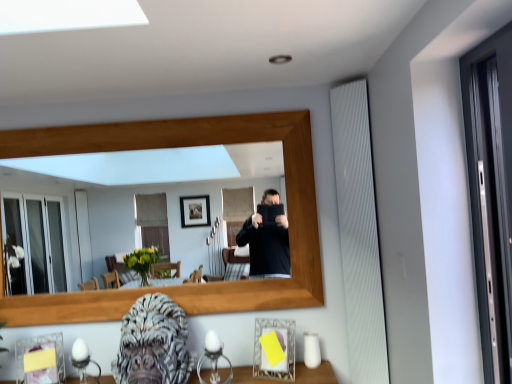
The width and height of the screenshot is (512, 384). Describe the element at coordinates (153, 190) in the screenshot. I see `wooden frame at center` at that location.

The image size is (512, 384). Describe the element at coordinates (153, 343) in the screenshot. I see `gray textured gorilla head at lower center` at that location.

This screenshot has height=384, width=512. What do you see at coordinates (281, 349) in the screenshot? I see `matte glass picture frame at lower right, which is counted as the 1th picture frame, starting from the right` at bounding box center [281, 349].

This screenshot has width=512, height=384. What are the coordinates of `matte glass picture frame at lower right, which is counted as the 1th picture frame, starting from the right` in the screenshot? It's located at (281, 349).

At what (x,y) coordinates should I click in order to perform the action: click on yellow paper at lower left, which is the 2th picture frame from right to left. Please return your answer as a coordinate pair (x, y). The image size is (512, 384). Looking at the image, I should click on click(40, 360).

Based on the photo, is yellow paper at lower left, which is counted as the first picture frame, starting from the left, wider or thinner than wooden frame at center?

Considering their sizes, yellow paper at lower left, which is counted as the first picture frame, starting from the left, looks broader than wooden frame at center.

Could you tell me if yellow paper at lower left, which is the 2th picture frame from right to left, is facing wooden frame at center?

No, yellow paper at lower left, which is the 2th picture frame from right to left, is not aimed at wooden frame at center.

Consider the image. Considering their positions, is yellow paper at lower left, which is the 2th picture frame from right to left, located in front of or behind wooden frame at center?

yellow paper at lower left, which is the 2th picture frame from right to left, is in front of wooden frame at center.

Is wooden frame at center to the left or to the right of yellow paper at lower left, which is the 2th picture frame from right to left, in the image?

wooden frame at center is positioned on yellow paper at lower left, which is the 2th picture frame from right to left,'s right side.

Is point (111, 163) more distant than point (22, 347)?

That is True.

Is wooden frame at center behind yellow paper at lower left, which is the 2th picture frame from right to left?

Yes.

Is matte glass picture frame at lower right, which is counted as the 2th picture frame, starting from the left, inside or outside of wooden frame at center?

matte glass picture frame at lower right, which is counted as the 2th picture frame, starting from the left, is not inside wooden frame at center, it's outside.

Between matte glass picture frame at lower right, which is counted as the 1th picture frame, starting from the right, and wooden frame at center, which one is positioned in front?

Positioned in front is matte glass picture frame at lower right, which is counted as the 1th picture frame, starting from the right.

Does point (284, 344) come farther from viewer compared to point (181, 258)?

No.

Is yellow paper at lower left, which is the 2th picture frame from right to left, placed right next to gray textured gorilla head at lower center?

No.

Based on the photo, from the image's perspective, between yellow paper at lower left, which is the 2th picture frame from right to left, and gray textured gorilla head at lower center, who is located below?

yellow paper at lower left, which is the 2th picture frame from right to left, is shown below in the image.

Between yellow paper at lower left, which is the 2th picture frame from right to left, and gray textured gorilla head at lower center, which one is positioned in front?

gray textured gorilla head at lower center is in front.

Considering the points (18, 342) and (149, 370), which point is in front, point (18, 342) or point (149, 370)?

The point (149, 370) is closer to the camera.

Considering the relative positions of gray textured gorilla head at lower center and yellow paper at lower left, which is the 2th picture frame from right to left, in the image provided, is gray textured gorilla head at lower center to the left or to the right of yellow paper at lower left, which is the 2th picture frame from right to left,?

Based on their positions, gray textured gorilla head at lower center is located to the right of yellow paper at lower left, which is the 2th picture frame from right to left.

What's the angular difference between gray textured gorilla head at lower center and yellow paper at lower left, which is the 2th picture frame from right to left,'s facing directions?

gray textured gorilla head at lower center and yellow paper at lower left, which is the 2th picture frame from right to left, are facing 22.7 degrees away from each other.

Who is smaller, gray textured gorilla head at lower center or yellow paper at lower left, which is the 2th picture frame from right to left?

yellow paper at lower left, which is the 2th picture frame from right to left, is smaller.

The image size is (512, 384). Identify the location of the 2nd picture frame below when counting from the gray textured gorilla head at lower center (from the image's perspective). tap(40, 360).

Locate an element on the screen. This screenshot has height=384, width=512. picture frame that is on the left side of matte glass picture frame at lower right, which is counted as the 1th picture frame, starting from the right is located at coordinates (40, 360).

Is matte glass picture frame at lower right, which is counted as the 2th picture frame, starting from the left, not inside yellow paper at lower left, which is the 2th picture frame from right to left?

matte glass picture frame at lower right, which is counted as the 2th picture frame, starting from the left, lies outside yellow paper at lower left, which is the 2th picture frame from right to left,'s area.

Is matte glass picture frame at lower right, which is counted as the 1th picture frame, starting from the right, positioned before yellow paper at lower left, which is counted as the first picture frame, starting from the left?

Yes.

Does wooden frame at center have a lesser width compared to gray textured gorilla head at lower center?

Correct, the width of wooden frame at center is less than that of gray textured gorilla head at lower center.

Is wooden frame at center not close to gray textured gorilla head at lower center?

That's not correct — wooden frame at center is a little close to gray textured gorilla head at lower center.

Is wooden frame at center looking in the opposite direction of gray textured gorilla head at lower center?

No, gray textured gorilla head at lower center is not at the back of wooden frame at center.

How many degrees apart are the facing directions of wooden frame at center and gray textured gorilla head at lower center?

The angle between the facing direction of wooden frame at center and the facing direction of gray textured gorilla head at lower center is 0.95 degrees.

From a real-world perspective, count 2nd picture frames downward from the wooden frame at center and point to it. Please provide its 2D coordinates.

[(40, 360)]

Locate an element on the screen. picture frame on the left side of wooden frame at center is located at coordinates (40, 360).

Based on their spatial positions, is gray textured gorilla head at lower center or matte glass picture frame at lower right, which is counted as the 1th picture frame, starting from the right, further from wooden frame at center?

matte glass picture frame at lower right, which is counted as the 1th picture frame, starting from the right, is further to wooden frame at center.

Estimate the real-world distances between objects in this image. Which object is closer to gray textured gorilla head at lower center, wooden frame at center or matte glass picture frame at lower right, which is counted as the 1th picture frame, starting from the right?

The object closer to gray textured gorilla head at lower center is matte glass picture frame at lower right, which is counted as the 1th picture frame, starting from the right.

When comparing their distances from matte glass picture frame at lower right, which is counted as the 2th picture frame, starting from the left, does gray textured gorilla head at lower center or wooden frame at center seem closer?

Based on the image, gray textured gorilla head at lower center appears to be nearer to matte glass picture frame at lower right, which is counted as the 2th picture frame, starting from the left.

Based on their spatial positions, is matte glass picture frame at lower right, which is counted as the 1th picture frame, starting from the right, or wooden frame at center further from yellow paper at lower left, which is counted as the first picture frame, starting from the left?

wooden frame at center is positioned further to the anchor yellow paper at lower left, which is counted as the first picture frame, starting from the left.

When comparing their distances from yellow paper at lower left, which is counted as the first picture frame, starting from the left, does matte glass picture frame at lower right, which is counted as the 2th picture frame, starting from the left, or gray textured gorilla head at lower center seem closer?

gray textured gorilla head at lower center.

Which object lies further to the anchor point wooden frame at center, yellow paper at lower left, which is counted as the first picture frame, starting from the left, or matte glass picture frame at lower right, which is counted as the 2th picture frame, starting from the left?

yellow paper at lower left, which is counted as the first picture frame, starting from the left, is further to wooden frame at center.

Based on their spatial positions, is matte glass picture frame at lower right, which is counted as the 2th picture frame, starting from the left, or yellow paper at lower left, which is counted as the first picture frame, starting from the left, closer to gray textured gorilla head at lower center?

The object closer to gray textured gorilla head at lower center is matte glass picture frame at lower right, which is counted as the 2th picture frame, starting from the left.

From the image, which object appears to be nearer to yellow paper at lower left, which is counted as the first picture frame, starting from the left, gray textured gorilla head at lower center or matte glass picture frame at lower right, which is counted as the 1th picture frame, starting from the right?

gray textured gorilla head at lower center is positioned closer to the anchor yellow paper at lower left, which is counted as the first picture frame, starting from the left.

Locate an element on the screen. This screenshot has width=512, height=384. gorilla between wooden frame at center and yellow paper at lower left, which is the 2th picture frame from right to left, in the up-down direction is located at coordinates coord(153,343).

Where is `gorilla between wooden frame at center and matte glass picture frame at lower right, which is counted as the 2th picture frame, starting from the left, vertically`? The image size is (512, 384). gorilla between wooden frame at center and matte glass picture frame at lower right, which is counted as the 2th picture frame, starting from the left, vertically is located at coordinates (153, 343).

This screenshot has width=512, height=384. Find the location of `mirror between yellow paper at lower left, which is the 2th picture frame from right to left, and matte glass picture frame at lower right, which is counted as the 2th picture frame, starting from the left, from left to right`. mirror between yellow paper at lower left, which is the 2th picture frame from right to left, and matte glass picture frame at lower right, which is counted as the 2th picture frame, starting from the left, from left to right is located at coordinates (153, 190).

Where is `gorilla situated between yellow paper at lower left, which is counted as the first picture frame, starting from the left, and matte glass picture frame at lower right, which is counted as the 2th picture frame, starting from the left, from left to right`? The image size is (512, 384). gorilla situated between yellow paper at lower left, which is counted as the first picture frame, starting from the left, and matte glass picture frame at lower right, which is counted as the 2th picture frame, starting from the left, from left to right is located at coordinates (153, 343).